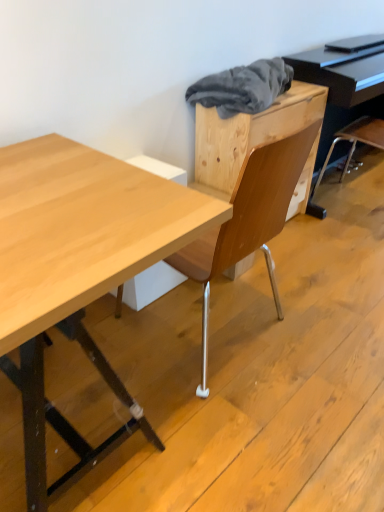
Question: Does black glossy piano at upper right have a lesser width compared to gray fabric at upper center?

Choices:
 (A) yes
 (B) no

Answer: (B)

Question: Does black glossy piano at upper right have a larger size compared to gray fabric at upper center?

Choices:
 (A) yes
 (B) no

Answer: (A)

Question: Does black glossy piano at upper right turn towards gray fabric at upper center?

Choices:
 (A) yes
 (B) no

Answer: (B)

Question: Could gray fabric at upper center be considered to be inside black glossy piano at upper right?

Choices:
 (A) no
 (B) yes

Answer: (A)

Question: Can you confirm if black glossy piano at upper right is positioned to the left of gray fabric at upper center?

Choices:
 (A) no
 (B) yes

Answer: (A)

Question: Does black glossy piano at upper right appear on the right side of gray fabric at upper center?

Choices:
 (A) yes
 (B) no

Answer: (A)

Question: Is gray fabric at upper center wider than black glossy piano at upper right?

Choices:
 (A) no
 (B) yes

Answer: (A)

Question: Is gray fabric at upper center thinner than black glossy piano at upper right?

Choices:
 (A) no
 (B) yes

Answer: (B)

Question: Is the position of gray fabric at upper center more distant than that of black glossy piano at upper right?

Choices:
 (A) no
 (B) yes

Answer: (A)

Question: Can you confirm if gray fabric at upper center is bigger than black glossy piano at upper right?

Choices:
 (A) no
 (B) yes

Answer: (A)

Question: Could you tell me if gray fabric at upper center is turned towards black glossy piano at upper right?

Choices:
 (A) yes
 (B) no

Answer: (B)

Question: From a real-world perspective, is gray fabric at upper center over black glossy piano at upper right?

Choices:
 (A) no
 (B) yes

Answer: (B)

Question: From a real-world perspective, is gray fabric at upper center located higher than natural wood desk at center?

Choices:
 (A) yes
 (B) no

Answer: (A)